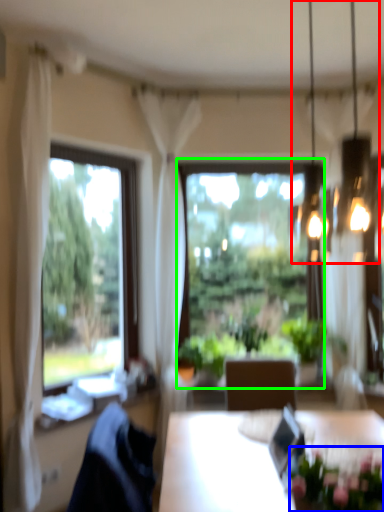
Question: Which is nearer to the chandelier (highlighted by a red box)? floral arrangement (highlighted by a blue box) or window (highlighted by a green box).

Choices:
 (A) floral arrangement
 (B) window

Answer: (B)